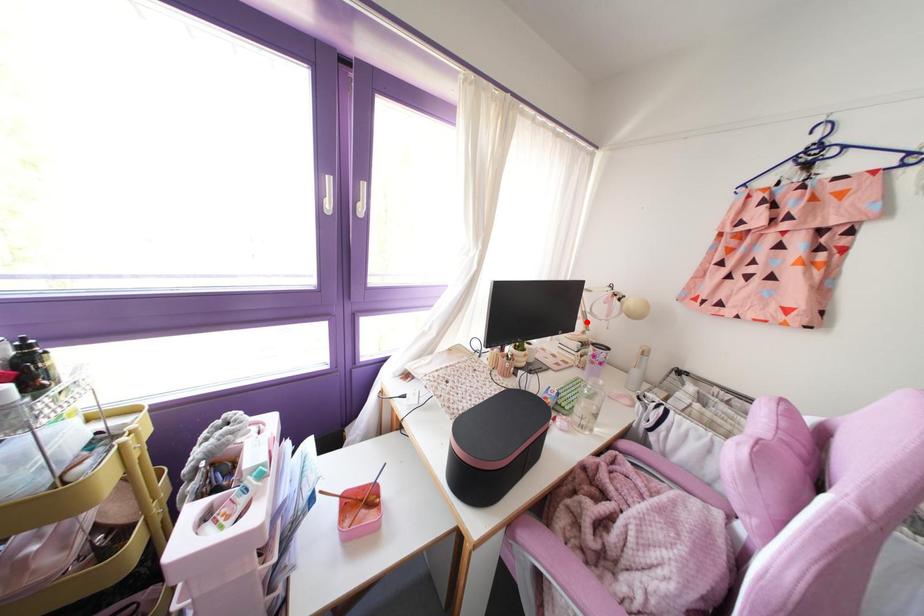
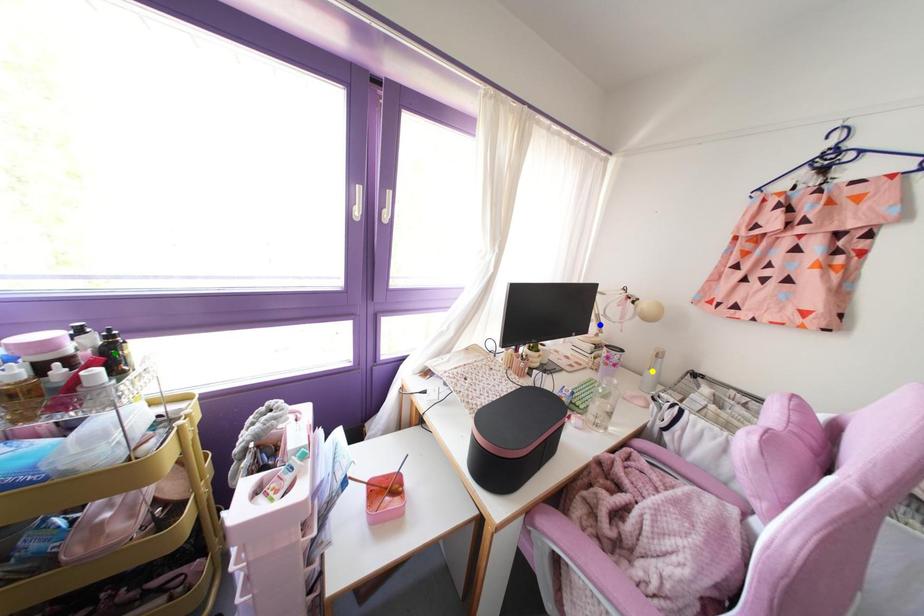
Question: I am providing you with two images of the same scene from different viewpoints. A red point is marked on the first image. You are given multiple points on the second image. Can you choose the point in image 2 that corresponds to the point in image 1?

Choices:
 (A) blue point
 (B) green point
 (C) yellow point

Answer: (A)